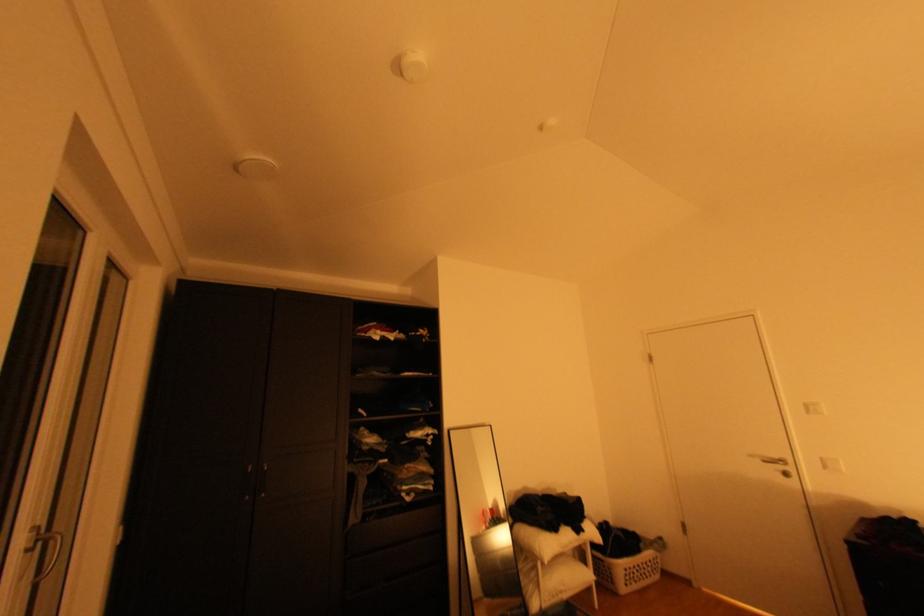
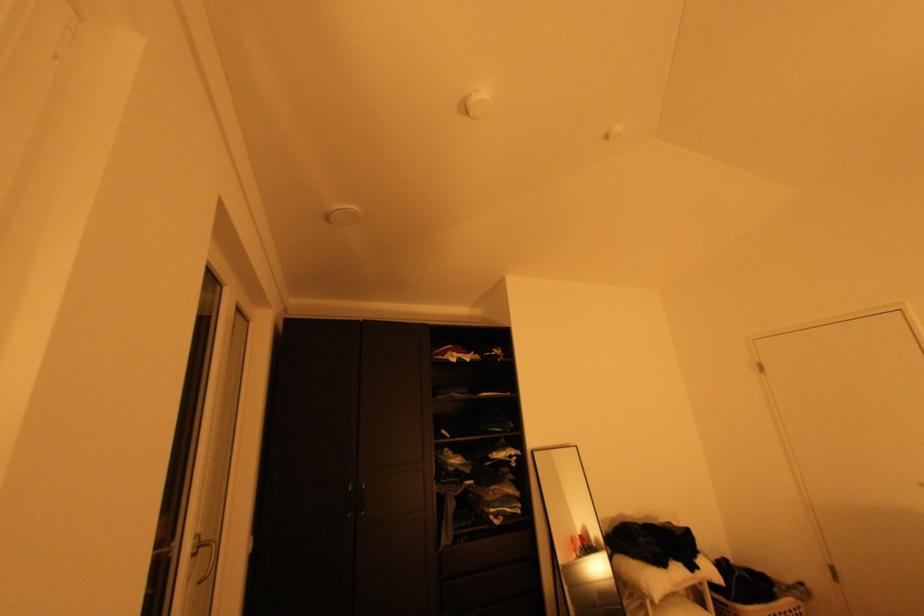
Question: The images are taken continuously from a first-person perspective. In which direction is your viewpoint rotating?

Choices:
 (A) Left
 (B) Right
 (C) Up
 (D) Down

Answer: (A)